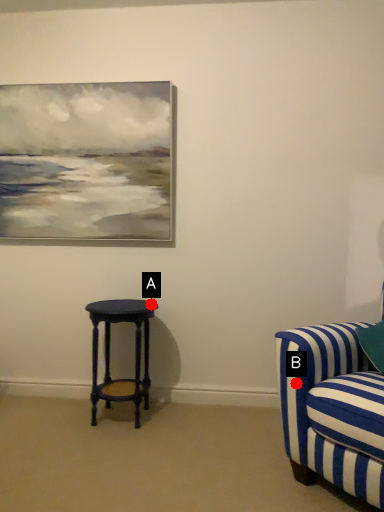
Question: Two points are circled on the image, labeled by A and B beside each circle. Which point is farther to the camera?

Choices:
 (A) A is further
 (B) B is further

Answer: (A)